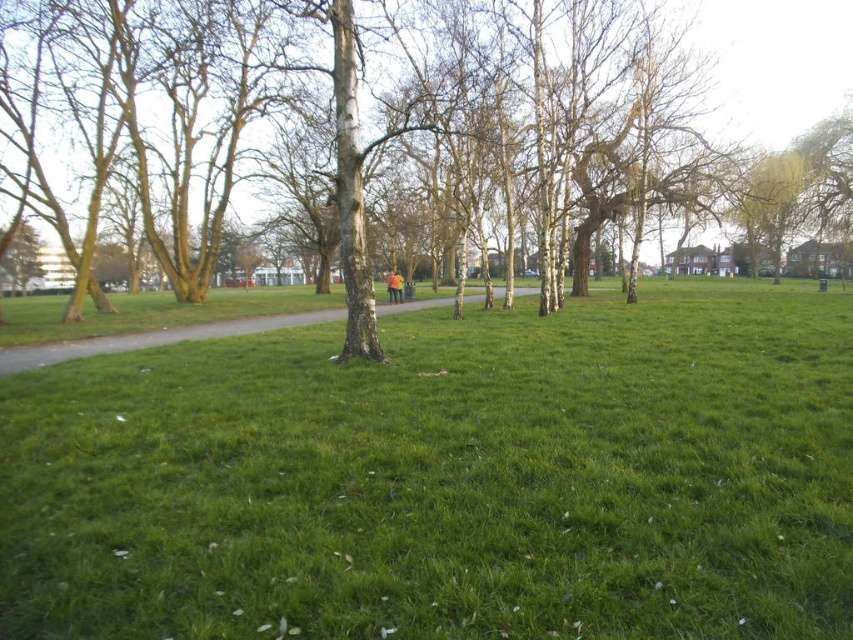
Does green grassy at center have a greater width compared to gravel path at center?

Correct, the width of green grassy at center exceeds that of gravel path at center.

Which is behind, point (825, 305) or point (254, 324)?

The point (825, 305) is behind.

The height and width of the screenshot is (640, 853). I want to click on green grassy at center, so click(x=445, y=477).

Between point (804, 106) and point (321, 317), which one is positioned behind?

Positioned behind is point (804, 106).

Is green bark tree at center bigger than gravel path at center?

Indeed, green bark tree at center has a larger size compared to gravel path at center.

Is point (848, 83) positioned after point (306, 310)?

Yes.

This screenshot has width=853, height=640. In order to click on green bark tree at center in this screenshot , I will do `click(775, 61)`.

Is point (801, 294) positioned after point (838, 86)?

No, it is in front of (838, 86).

What do you see at coordinates (445, 477) in the screenshot?
I see `green grassy at center` at bounding box center [445, 477].

The height and width of the screenshot is (640, 853). I want to click on green grassy at center, so click(445, 477).